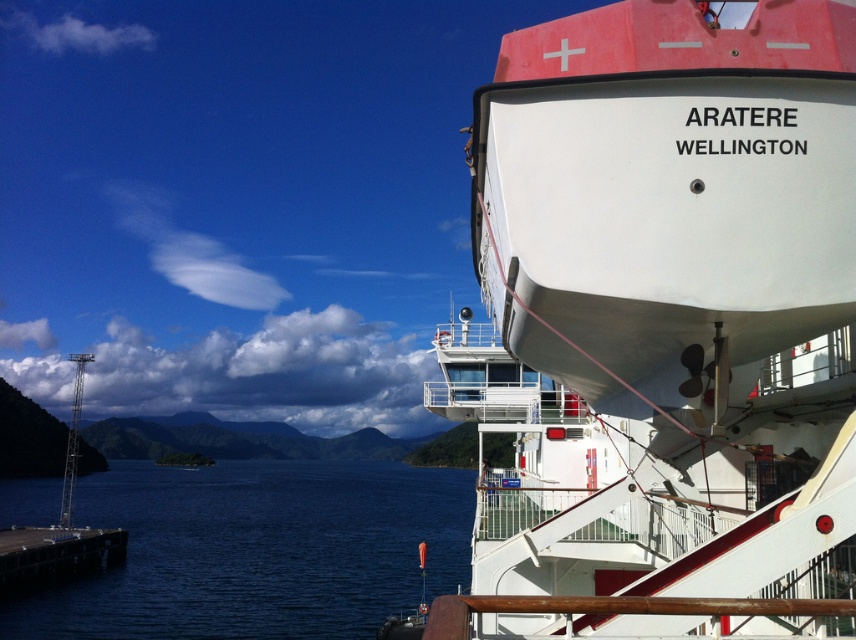
Who is positioned more to the left, white matte ship at upper right or blue water at lower left?

blue water at lower left

Which of these two, white matte ship at upper right or blue water at lower left, stands taller?

blue water at lower left is taller.

Image resolution: width=856 pixels, height=640 pixels. Identify the location of white matte ship at upper right. (660, 316).